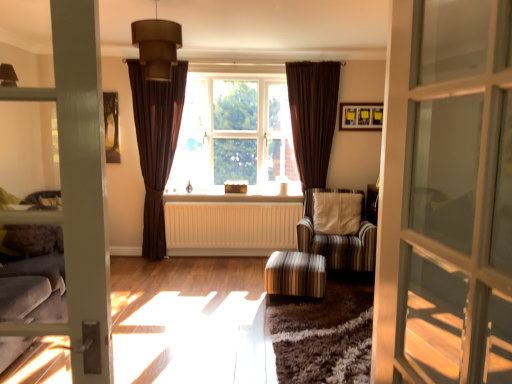
Locate an element on the screen. striped fabric stool at lower center is located at coordinates (295, 274).

The width and height of the screenshot is (512, 384). In order to click on brown fabric window at center in this screenshot , I will do `click(234, 135)`.

Measure the distance between matte glass door at right and camera.

matte glass door at right and camera are 24.12 inches apart from each other.

The height and width of the screenshot is (384, 512). Describe the element at coordinates (446, 196) in the screenshot. I see `matte glass door at right` at that location.

This screenshot has height=384, width=512. Find the location of `white textured radiator at center`. white textured radiator at center is located at coordinates (231, 225).

Locate an element on the screen. Image resolution: width=512 pixels, height=384 pixels. striped fabric armchair at center is located at coordinates (339, 238).

Image resolution: width=512 pixels, height=384 pixels. Identify the location of white painted wood at center. (241, 194).

Is striped fabric armchair at center inside or outside of white painted wood at center?

striped fabric armchair at center is not enclosed by white painted wood at center.

Which object is more forward, striped fabric armchair at center or white painted wood at center?

striped fabric armchair at center is in front.

Is point (306, 214) in front of point (240, 193)?

That is True.

From a real-world perspective, is striped fabric armchair at center located higher than white painted wood at center?

No, from a real-world perspective, striped fabric armchair at center is not over white painted wood at center

Considering the sizes of white painted wood at center and white textured radiator at center in the image, is white painted wood at center taller or shorter than white textured radiator at center?

In the image, white painted wood at center appears to be shorter than white textured radiator at center.

Which is nearer, (291, 196) or (270, 204)?

Point (291, 196) appears to be farther away from the viewer than point (270, 204).

Where is `radiator below the white painted wood at center (from the image's perspective)`? The image size is (512, 384). radiator below the white painted wood at center (from the image's perspective) is located at coordinates (231, 225).

Who is taller, brown fabric lampshade at upper center or brown textured curtain at center, which ranks as the 2th curtain in right-to-left order?

With more height is brown textured curtain at center, which ranks as the 2th curtain in right-to-left order.

Which of these two, brown fabric lampshade at upper center or brown textured curtain at center, which ranks as the 2th curtain in right-to-left order, is smaller?

Smaller between the two is brown fabric lampshade at upper center.

Is brown fabric lampshade at upper center not close to brown textured curtain at center, which is counted as the 1th curtain, starting from the left?

brown fabric lampshade at upper center is positioned a significant distance from brown textured curtain at center, which is counted as the 1th curtain, starting from the left.

Can you confirm if brown fabric lampshade at upper center is thinner than brown textured curtain at center, which ranks as the 2th curtain in right-to-left order?

No, brown fabric lampshade at upper center is not thinner than brown textured curtain at center, which ranks as the 2th curtain in right-to-left order.

Would you say white painted wood at center is inside or outside brown fabric lampshade at upper center?

white painted wood at center is not inside brown fabric lampshade at upper center, it's outside.

From the picture: Measure the distance between white painted wood at center and brown fabric lampshade at upper center.

They are 7.26 feet apart.

Considering the positions of points (227, 196) and (167, 61), is point (227, 196) closer to camera compared to point (167, 61)?

That is False.

Considering their positions, is white painted wood at center located in front of or behind brown fabric lampshade at upper center?

Visually, white painted wood at center is located behind brown fabric lampshade at upper center.

Considering the sizes of objects brown fabric lampshade at upper center and striped fabric armchair at center in the image provided, who is shorter, brown fabric lampshade at upper center or striped fabric armchair at center?

brown fabric lampshade at upper center.

Is brown fabric lampshade at upper center wider than striped fabric armchair at center?

In fact, brown fabric lampshade at upper center might be narrower than striped fabric armchair at center.

Are brown fabric lampshade at upper center and striped fabric armchair at center located far from each other?

Absolutely, brown fabric lampshade at upper center is distant from striped fabric armchair at center.

From the image's perspective, between brown fabric lampshade at upper center and striped fabric armchair at center, who is located below?

striped fabric armchair at center appears lower in the image.

Between brown textured curtain at center, which is counted as the 1th curtain, starting from the left, and brown fabric window at center, which one is positioned in front?

Positioned in front is brown textured curtain at center, which is counted as the 1th curtain, starting from the left.

Is brown textured curtain at center, which is counted as the 1th curtain, starting from the left, aimed at brown fabric window at center?

No, brown textured curtain at center, which is counted as the 1th curtain, starting from the left, does not turn towards brown fabric window at center.

What's the angular difference between brown textured curtain at center, which is counted as the 1th curtain, starting from the left, and brown fabric window at center's facing directions?

They differ by 0.92 degrees in their facing directions.

Does brown textured curtain at center, which ranks as the 2th curtain in right-to-left order, touch brown fabric window at center?

There is a gap between brown textured curtain at center, which ranks as the 2th curtain in right-to-left order, and brown fabric window at center.

Is striped fabric stool at lower center turned away from white painted wood at center?

No, striped fabric stool at lower center is not facing away from white painted wood at center.

Locate an element on the screen. Image resolution: width=512 pixels, height=384 pixels. window sill behind the striped fabric stool at lower center is located at coordinates (241, 194).

Is striped fabric stool at lower center spatially inside white painted wood at center, or outside of it?

striped fabric stool at lower center cannot be found inside white painted wood at center.

From a real-world perspective, between striped fabric stool at lower center and white painted wood at center, who is vertically lower?

striped fabric stool at lower center is physically lower.

In the image, there is a white painted wood at center. At what (x,y) coordinates should I click in order to perform the action: click on chair below it (from the image's perspective). Please return your answer as a coordinate pair (x, y). Image resolution: width=512 pixels, height=384 pixels. Looking at the image, I should click on 339,238.

The height and width of the screenshot is (384, 512). Find the location of `radiator in front of the white painted wood at center`. radiator in front of the white painted wood at center is located at coordinates (231, 225).

Looking at the image, which one is located further to brown fabric window at center, brown velvet curtain at right, acting as the 2th curtain starting from the left, or striped fabric stool at lower center?

striped fabric stool at lower center.

Based on their spatial positions, is matte black picture frame at upper right or striped fabric stool at lower center further from brown textured curtain at center, which is counted as the 1th curtain, starting from the left?

Based on the image, matte black picture frame at upper right appears to be further to brown textured curtain at center, which is counted as the 1th curtain, starting from the left.

From the image, which object appears to be nearer to matte glass door at right, striped fabric armchair at center or striped fabric stool at lower center?

striped fabric stool at lower center lies closer to matte glass door at right than the other object.

Based on their spatial positions, is brown fabric window at center or striped fabric stool at lower center further from striped fabric armchair at center?

brown fabric window at center.

Consider the image. Based on their spatial positions, is matte glass door at right or striped fabric stool at lower center closer to brown fabric lampshade at upper center?

The object closer to brown fabric lampshade at upper center is striped fabric stool at lower center.

Based on their spatial positions, is brown fabric window at center or striped fabric armchair at center closer to brown velvet curtain at right, which ranks as the 1th curtain in right-to-left order?

brown fabric window at center lies closer to brown velvet curtain at right, which ranks as the 1th curtain in right-to-left order, than the other object.

Considering their positions, is brown fabric lampshade at upper center positioned further to striped fabric armchair at center than white painted wood at center?

Based on the image, brown fabric lampshade at upper center appears to be further to striped fabric armchair at center.

Looking at this image, which object lies further to the anchor point matte glass door at right, striped fabric stool at lower center or brown velvet curtain at right, acting as the 2th curtain starting from the left?

brown velvet curtain at right, acting as the 2th curtain starting from the left, lies further to matte glass door at right than the other object.

Find the location of a particular element. The width and height of the screenshot is (512, 384). chair positioned between brown fabric lampshade at upper center and white textured radiator at center from near to far is located at coordinates (339, 238).

Identify the location of light fixture located between brown textured curtain at center, which is counted as the 1th curtain, starting from the left, and matte black picture frame at upper right in the left-right direction. (157, 46).

This screenshot has height=384, width=512. In order to click on curtain located between white painted wood at center and matte black picture frame at upper right in the left-right direction in this screenshot , I will do `click(313, 117)`.

The height and width of the screenshot is (384, 512). Find the location of `stool positioned between brown fabric lampshade at upper center and brown textured curtain at center, which ranks as the 2th curtain in right-to-left order, from near to far`. stool positioned between brown fabric lampshade at upper center and brown textured curtain at center, which ranks as the 2th curtain in right-to-left order, from near to far is located at coordinates (295, 274).